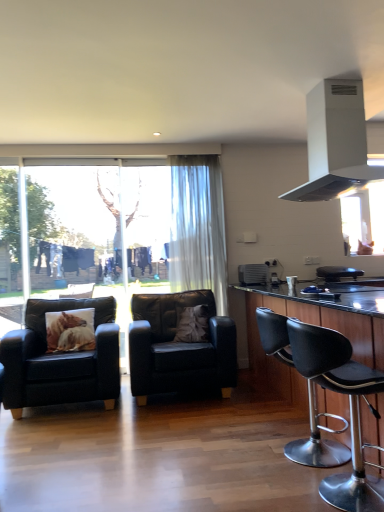
Question: Considering their positions, is black leather chair at center, which ranks as the 3th chair in right-to-left order, located in front of or behind black leather cabinet at right?

Choices:
 (A) front
 (B) behind

Answer: (B)

Question: Considering the positions of black leather chair at center, which is the second chair in back-to-front order, and black leather cabinet at right in the image, is black leather chair at center, which is the second chair in back-to-front order, bigger or smaller than black leather cabinet at right?

Choices:
 (A) small
 (B) big

Answer: (A)

Question: Based on their relative distances, which object is farther from the printed fabric pillow at left, the 2th pillow viewed from the right?

Choices:
 (A) sheer white curtain at center
 (B) matte black armchair at left, the 4th chair from the right
 (C) satin silver air conditioner at center
 (D) brown fabric pillow at center, the 1th pillow from the right
 (E) black leather chair at center, the 2th chair positioned from the left

Answer: (C)

Question: Considering the real-world distances, which object is closest to the black leather cabinet at right?

Choices:
 (A) sheer white curtain at center
 (B) white matte range hood at upper right
 (C) matte black armchair at left, acting as the third chair starting from the back
 (D) black leather chair at center, acting as the 1th chair starting from the back
 (E) printed fabric pillow at left, the 1th pillow in the left-to-right sequence

Answer: (A)